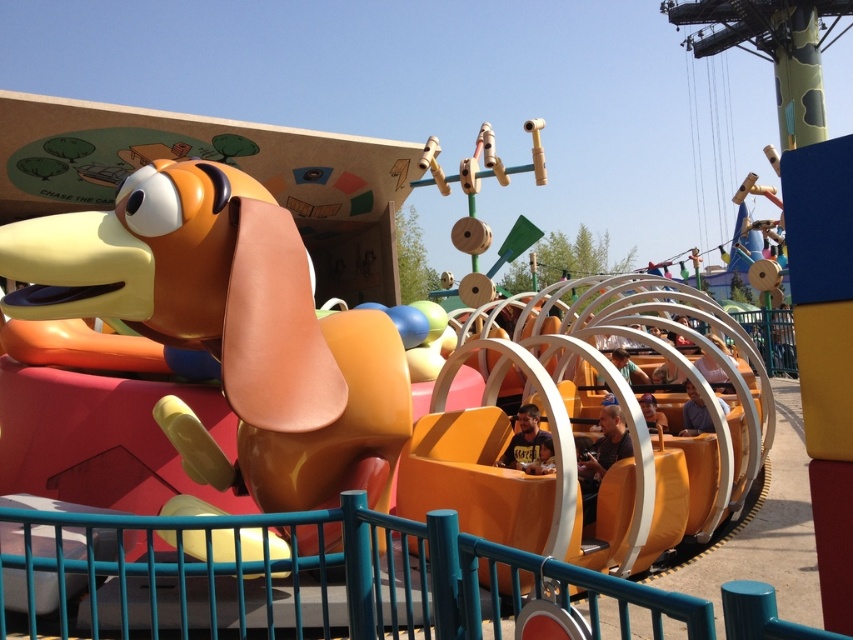
Does matte orange shirt at center have a greater width compared to matte yellow shirt at center?

Incorrect, matte orange shirt at center's width does not surpass matte yellow shirt at center's.

Is matte orange shirt at center thinner than matte yellow shirt at center?

Yes, matte orange shirt at center is thinner than matte yellow shirt at center.

Which is in front, point (628, 435) or point (689, 432)?

Point (628, 435) is in front.

Locate an element on the screen. matte orange shirt at center is located at coordinates (605, 448).

How distant is matte orange dog at left from matte brown hair at center?

matte orange dog at left is 15.79 feet away from matte brown hair at center.

Between point (363, 422) and point (636, 365), which one is positioned behind?

The point (636, 365) is more distant.

This screenshot has height=640, width=853. What do you see at coordinates (225, 324) in the screenshot?
I see `matte orange dog at left` at bounding box center [225, 324].

Where is `matte orange dog at left`? The width and height of the screenshot is (853, 640). matte orange dog at left is located at coordinates (225, 324).

Which of these two, matte yellow helmet at center or smooth brown hair at center, stands shorter?

With less height is smooth brown hair at center.

Is matte yellow helmet at center shorter than smooth brown hair at center?

Incorrect, matte yellow helmet at center's height does not fall short of smooth brown hair at center's.

The image size is (853, 640). Describe the element at coordinates (525, 440) in the screenshot. I see `matte yellow helmet at center` at that location.

Locate an element on the screen. This screenshot has height=640, width=853. matte yellow helmet at center is located at coordinates (525, 440).